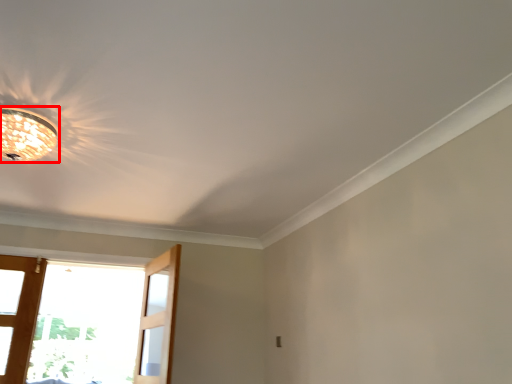
Question: From the image, what is the correct spatial relationship of lamp (annotated by the red box) in relation to screen door?

Choices:
 (A) left
 (B) right

Answer: (A)